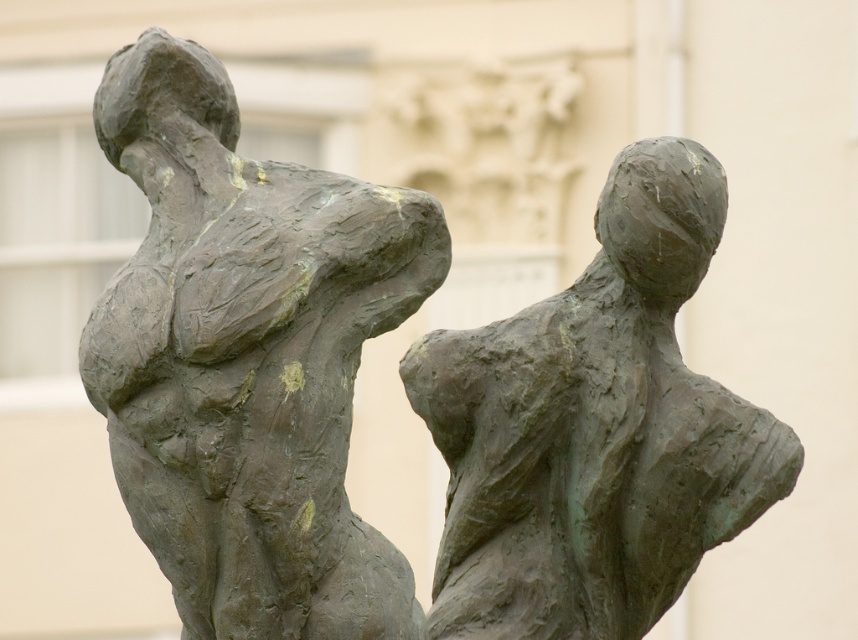
You are an art curator planning to display the bronze statue at center and the green patina bronze figure at center in a gallery. Given their sizes, which one should be placed on the taller pedestal to ensure both are viewed at eye level?

The green patina bronze figure at center should be placed on the taller pedestal because it is larger than the bronze statue at center, ensuring both are viewed at eye level.

You are standing in front of the bronze statue at center. If you want to take a photo of it with your smartphone, which has a maximum focus range of 100 feet, will you be able to capture it clearly?

The bronze statue at center is 137.45 feet away from camera, which exceeds the smartphone camera maximum focus range of 100 feet. Therefore, the statue will be out of focus and not captured clearly.

You are an art conservator examining two bronze sculptures positioned back to back. You need to inspect the one that is nearer to you first. Which sculpture should you examine first, the bronze statue at center or the green patina bronze figure at center?

The bronze statue at center is closer to the viewer than the green patina bronze figure at center, so you should examine the bronze statue at center first.